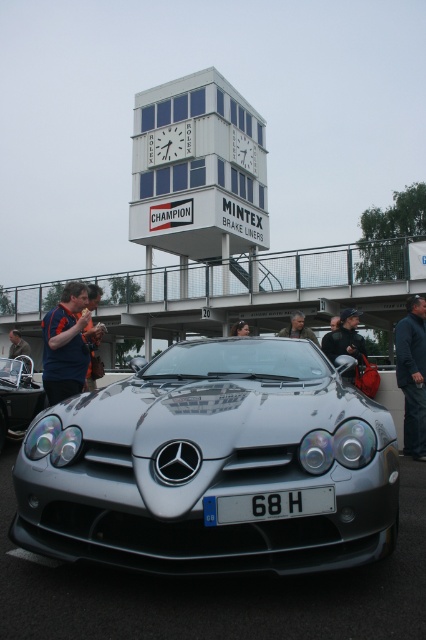
Is white concrete clock tower at upper center behind silver metallic car at center?

Yes, it is.

Who is higher up, white concrete clock tower at upper center or silver metallic car at center?

white concrete clock tower at upper center is above.

In order to click on white concrete clock tower at upper center in this screenshot , I will do `click(198, 172)`.

From the picture: Is blue shirt at left in front of dark blue fabric jacket at lower right?

Yes.

Image resolution: width=426 pixels, height=640 pixels. Describe the element at coordinates (66, 342) in the screenshot. I see `blue shirt at left` at that location.

The height and width of the screenshot is (640, 426). Find the location of `blue shirt at left`. blue shirt at left is located at coordinates (66, 342).

Is point (313, 541) closer to camera compared to point (51, 349)?

Yes, point (313, 541) is in front of point (51, 349).

Who is more forward, (85, 483) or (62, 388)?

Positioned in front is point (85, 483).

Where is `sleek metallic car at center`? This screenshot has width=426, height=640. sleek metallic car at center is located at coordinates (213, 465).